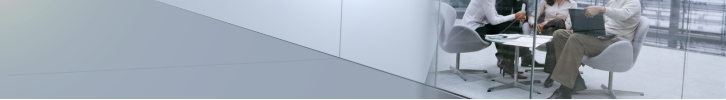
Find the location of a particular element. The width and height of the screenshot is (726, 100). office floor is located at coordinates (653, 63).